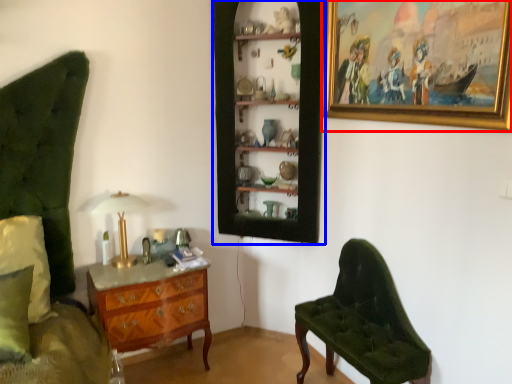
Question: Which point is further to the camera, picture frame (highlighted by a red box) or shelf (highlighted by a blue box)?

Choices:
 (A) picture frame
 (B) shelf

Answer: (B)